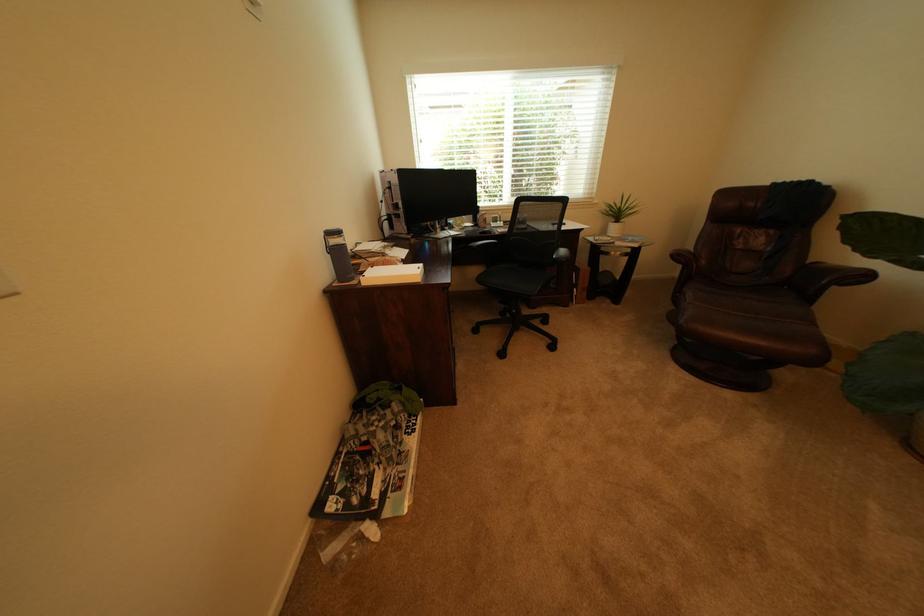
I want to click on black chair armrest, so pos(687,257).